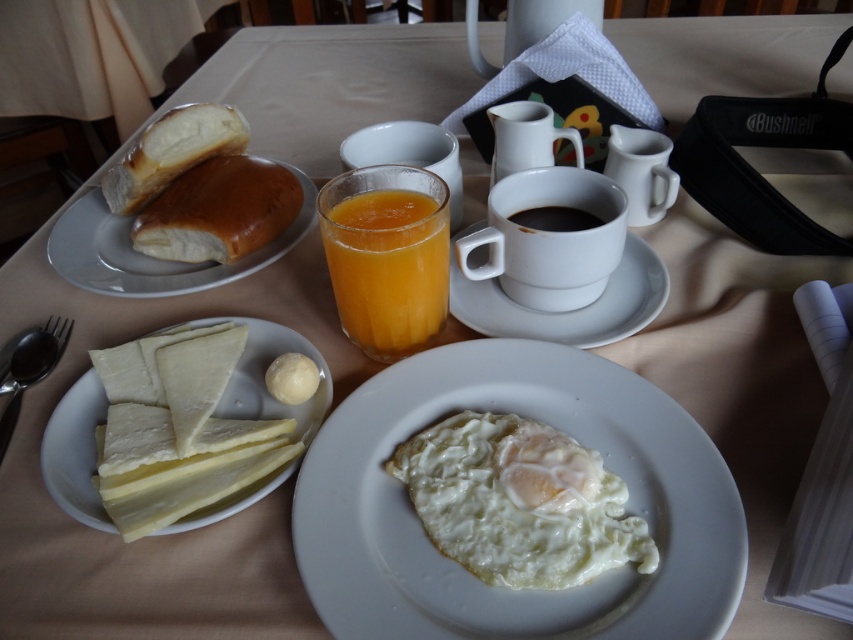
Which is behind, point (256, 326) or point (138, 273)?

The point (138, 273) is behind.

Is point (91, 500) closer to camera compared to point (71, 266)?

Yes, point (91, 500) is closer to viewer.

Locate an element on the screen. white cheese at lower left is located at coordinates (263, 380).

Can you confirm if black matte cup at center is positioned to the right of white cheese at lower left?

Indeed, black matte cup at center is positioned on the right side of white cheese at lower left.

In the scene shown: Is black matte cup at center shorter than white cheese at lower left?

Yes, black matte cup at center is shorter than white cheese at lower left.

I want to click on black matte cup at center, so click(x=549, y=237).

You are a GUI agent. You are given a task and a screenshot of the screen. Output one action in this format:
    pyautogui.click(x=<x>, y=<y>)
    Task: Click on the black matte cup at center
    
    Given the screenshot: What is the action you would take?
    (x=549, y=237)

Between translucent glass orange juice at center and white cheese at lower left, which one has more height?

With more height is translucent glass orange juice at center.

Is point (354, 269) closer to camera compared to point (183, 524)?

No, (354, 269) is further to viewer.

You are a GUI agent. You are given a task and a screenshot of the screen. Output one action in this format:
    pyautogui.click(x=<x>, y=<y>)
    Task: Click on the translucent glass orange juice at center
    
    Given the screenshot: What is the action you would take?
    pyautogui.click(x=386, y=266)